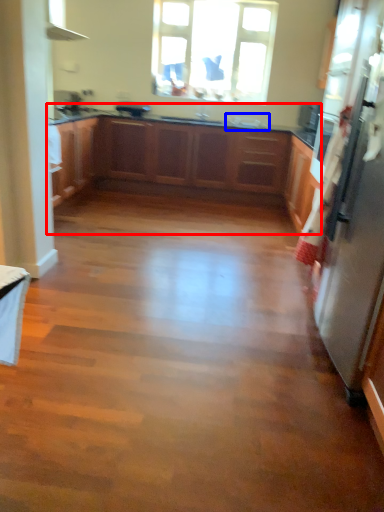
Question: Which object is further to the camera taking this photo, cabinetry (highlighted by a red box) or sink (highlighted by a blue box)?

Choices:
 (A) cabinetry
 (B) sink

Answer: (B)